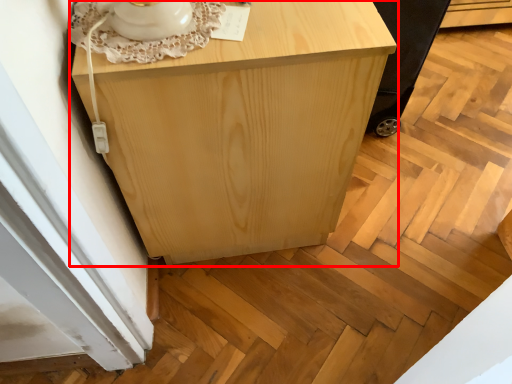
Question: From the image's perspective, what is the correct spatial relationship of furniture (annotated by the red box) in relation to baby carriage?

Choices:
 (A) below
 (B) above

Answer: (A)